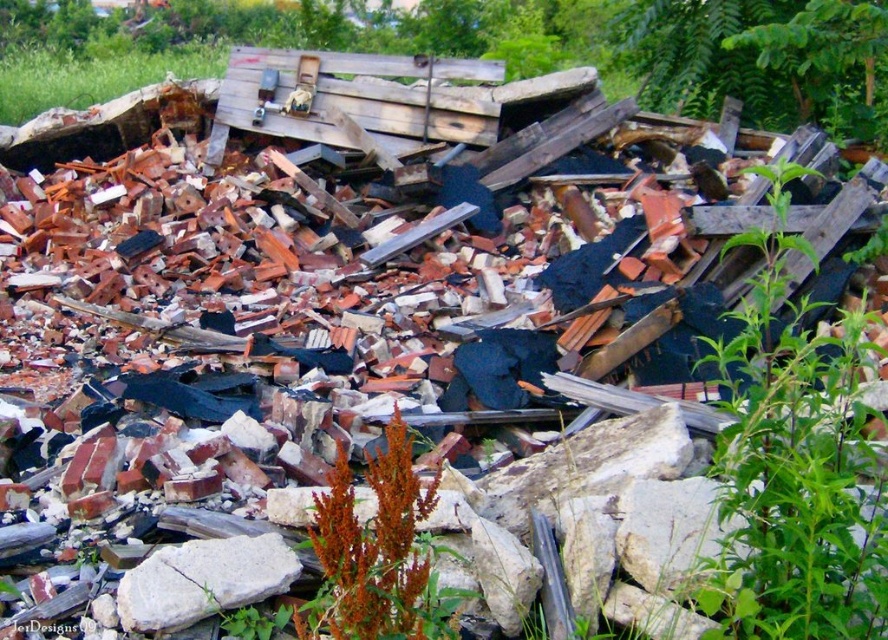
You are a drone operator trying to locate a green leafy plant in a debris field. The debris field is shown in the image with coordinates from 0 to 1 in both x and y directions. The green leafy plant is represented by the point at coordinates point (x=794, y=470). Can you determine the location of the green leafy plant in terms of its coordinates?

The green leafy plant at upper right is located at coordinates point (x=794, y=470).

You are a gardener who wants to water the brown fuzzy plant at center. You have a watering can that can spray water up to 2 meters. Can you reach the plant without moving closer?

The brown fuzzy plant at center is 2.36 meters away from the viewer. Since the watering can can only spray up to 2 meters, you cannot reach the plant without moving closer.

You are a gardener looking for a specific plant. You see a brown fuzzy plant at center and a white rough stone at center. Which object is positioned to the right side from your viewpoint?

The brown fuzzy plant at center is to the right of the white rough stone at center, so the brown fuzzy plant at center is positioned to the right side from your viewpoint.